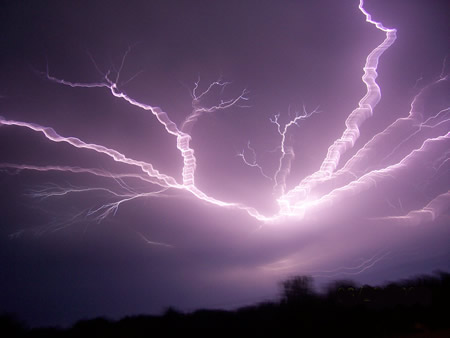
You are a GUI agent. You are given a task and a screenshot of the screen. Output one action in this format:
    pyautogui.click(x=<x>, y=<y>)
    Task: Click on the light
    This screenshot has width=450, height=338.
    Given the screenshot: What is the action you would take?
    pyautogui.click(x=293, y=212)